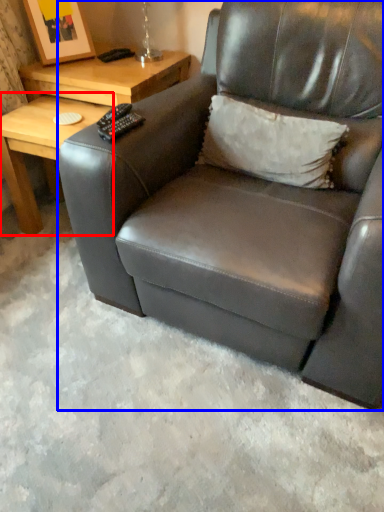
Question: Which object appears farthest to the camera in this image, table (highlighted by a red box) or chair (highlighted by a blue box)?

Choices:
 (A) table
 (B) chair

Answer: (A)